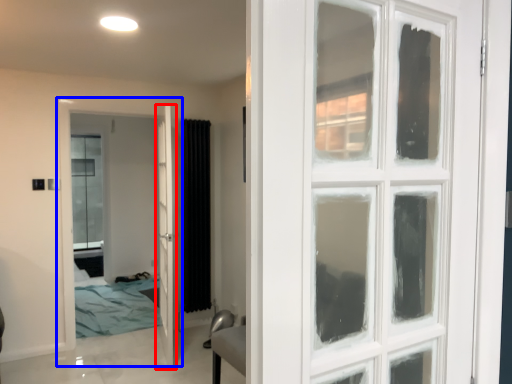
Question: Which point is further to the camera, door (highlighted by a red box) or door (highlighted by a blue box)?

Choices:
 (A) door
 (B) door

Answer: (B)